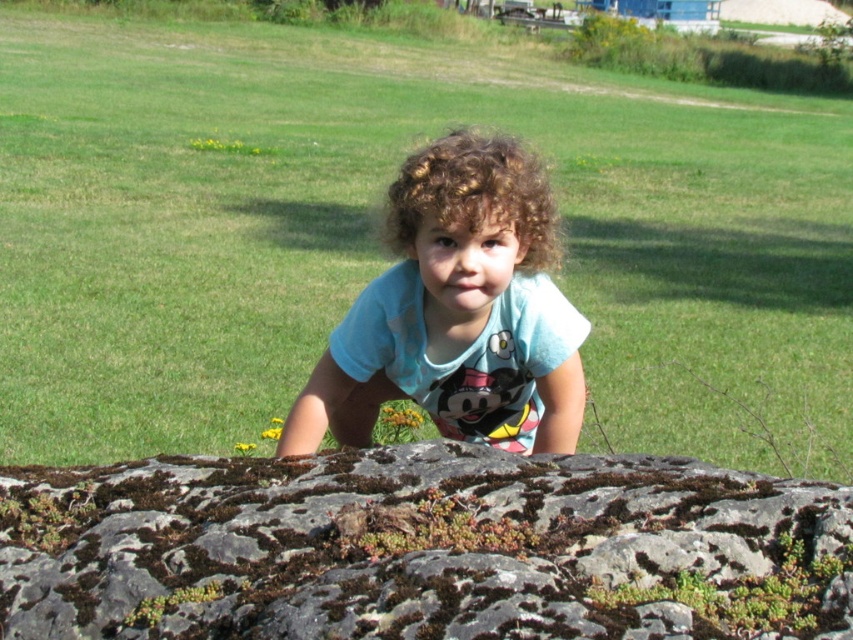
The child is wearing a light blue cotton shirt at center and has curly brown hair at center. Which part of the child is wider?

The curly brown hair at center is wider than the light blue cotton shirt at center.

Looking at this image, you are a photographer trying to capture the light blue cotton shirt at center in the image. The camera you are using has a focus point at point (457, 310). Will the light blue cotton shirt at center be in focus?

The light blue cotton shirt at center is located at point (457, 310), so yes, the light blue cotton shirt at center will be in focus because the focus point is exactly at that coordinate.

You are a photographer positioned at the edge of the grassy field. You want to take a photo of the child leaning over the green mossy rock at center. Where should you position your camera to capture the rock at point (421, 548)?

The green mossy rock at center is located at point (421, 548), so you should position your camera at the edge of the grassy field facing towards the center to capture the rock at that coordinate.